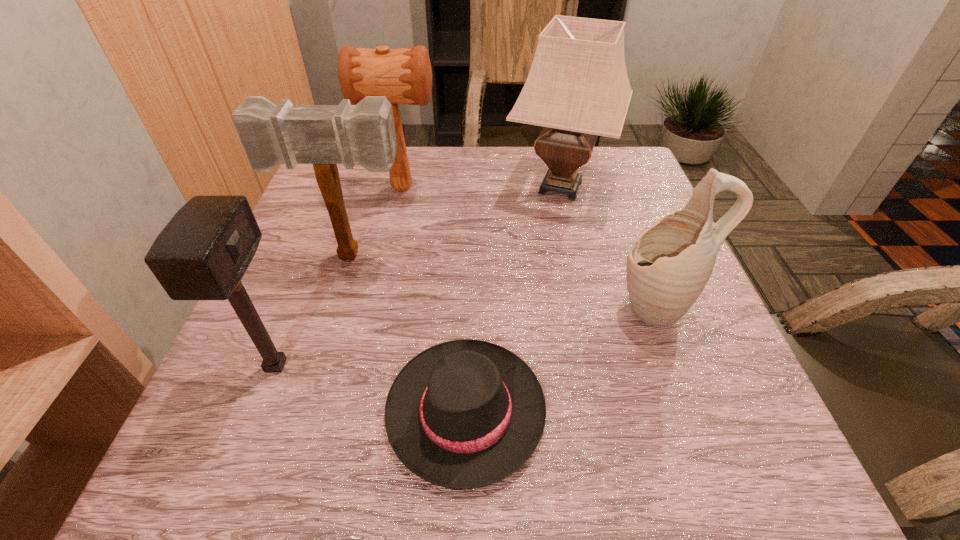
I want to click on object that is at the far right corner, so click(x=578, y=88).

In order to click on free space at the far edge of the desktop in this screenshot , I will do `click(427, 181)`.

Find the location of `vacant region at the left edge of the desktop`. vacant region at the left edge of the desktop is located at coordinates (295, 426).

The width and height of the screenshot is (960, 540). Find the location of `free space at the right edge of the desktop`. free space at the right edge of the desktop is located at coordinates (628, 317).

Locate an element on the screen. This screenshot has width=960, height=540. free location at the far left corner is located at coordinates (372, 183).

This screenshot has width=960, height=540. Find the location of `vacant space at the far right corner`. vacant space at the far right corner is located at coordinates (602, 168).

Image resolution: width=960 pixels, height=540 pixels. What are the coordinates of `vacant space at the near right corner of the desktop` in the screenshot? It's located at (x=670, y=461).

The image size is (960, 540). What are the coordinates of `free spot between the farthest mallet and the shortest object` in the screenshot? It's located at (434, 300).

Where is `empty space between the lampshade and the nearest mallet`? The height and width of the screenshot is (540, 960). empty space between the lampshade and the nearest mallet is located at coordinates point(419,276).

Where is `vacant area that lies between the dress hat and the farthest mallet`? The height and width of the screenshot is (540, 960). vacant area that lies between the dress hat and the farthest mallet is located at coordinates (434, 300).